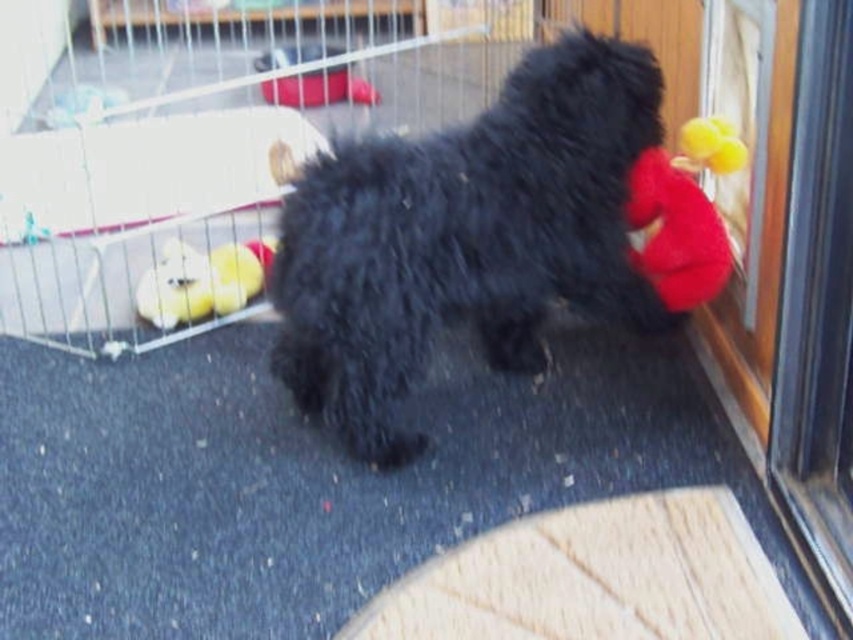
Who is positioned more to the left, red plush toy at right or yellow plush duck at left?

From the viewer's perspective, yellow plush duck at left appears more on the left side.

Who is lower down, red plush toy at right or yellow plush duck at left?

yellow plush duck at left is lower down.

Locate an element on the screen. The height and width of the screenshot is (640, 853). red plush toy at right is located at coordinates (675, 232).

Is point (233, 20) closer to camera compared to point (699, 234)?

No.

Which of these two, metal wire cage at center or red plush toy at right, stands shorter?

red plush toy at right

Locate an element on the screen. The image size is (853, 640). metal wire cage at center is located at coordinates (201, 144).

Between metal wire cage at center and black fluffy dog at center, which one is positioned lower?

Positioned lower is black fluffy dog at center.

Which is in front, point (88, 76) or point (613, 252)?

Positioned in front is point (613, 252).

Is point (277, 125) less distant than point (410, 198)?

That is False.

Where is `metal wire cage at center`? metal wire cage at center is located at coordinates (201, 144).